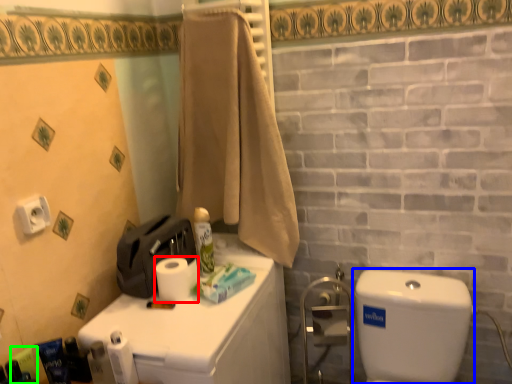
Question: Based on their relative distances, which object is nearer to toilet paper (highlighted by a red box)? Choose from water tank (highlighted by a blue box) and toiletry (highlighted by a green box).

Choices:
 (A) water tank
 (B) toiletry

Answer: (B)